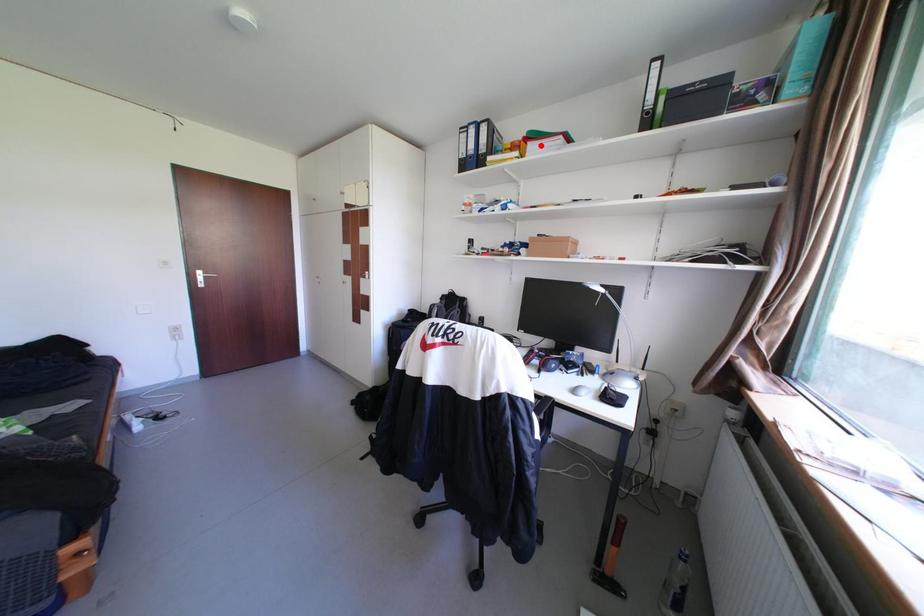
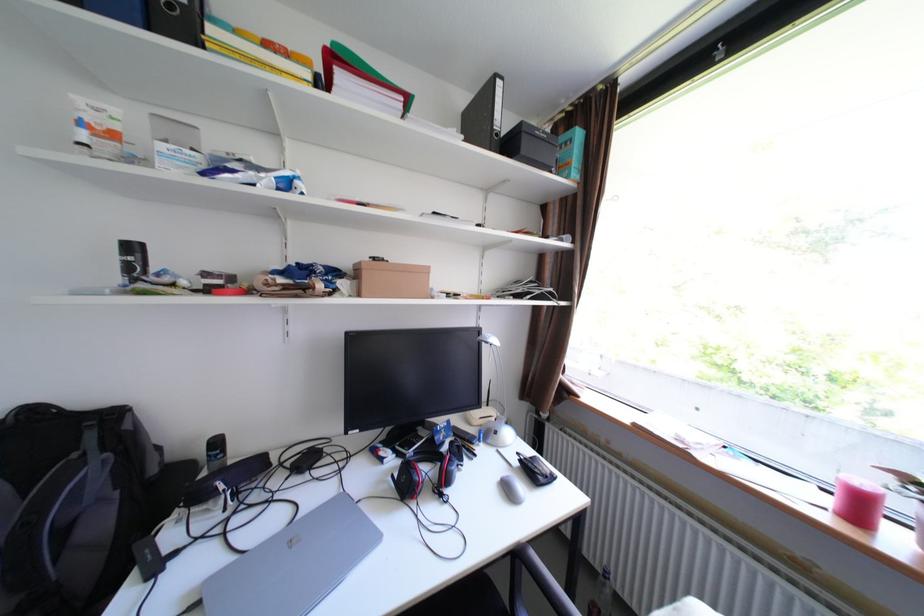
Where in the second image is the point corresponding to the highlighted location from the first image?

(351, 76)